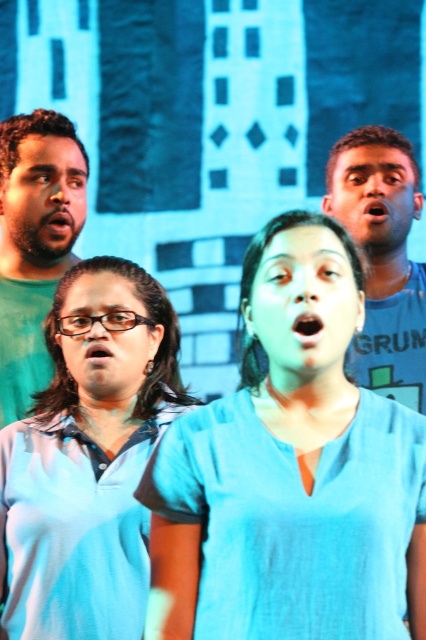
Question: Which object appears closest to the camera in this image?

Choices:
 (A) blue cotton shirt at center
 (B) matte green shirt at left

Answer: (A)

Question: Estimate the real-world distances between objects in this image. Which object is farther from the matte green shirt at left?

Choices:
 (A) blue fabric shirt at center
 (B) blue cotton shirt at center

Answer: (B)

Question: Does blue cotton shirt at center appear on the right side of blue cotton shirt at upper right?

Choices:
 (A) yes
 (B) no

Answer: (B)

Question: Is blue fabric shirt at center smaller than matte green shirt at left?

Choices:
 (A) no
 (B) yes

Answer: (A)

Question: Can you confirm if blue cotton shirt at center is wider than blue cotton shirt at upper right?

Choices:
 (A) yes
 (B) no

Answer: (A)

Question: Which object appears farthest from the camera in this image?

Choices:
 (A) blue cotton shirt at upper right
 (B) blue cotton shirt at center

Answer: (A)